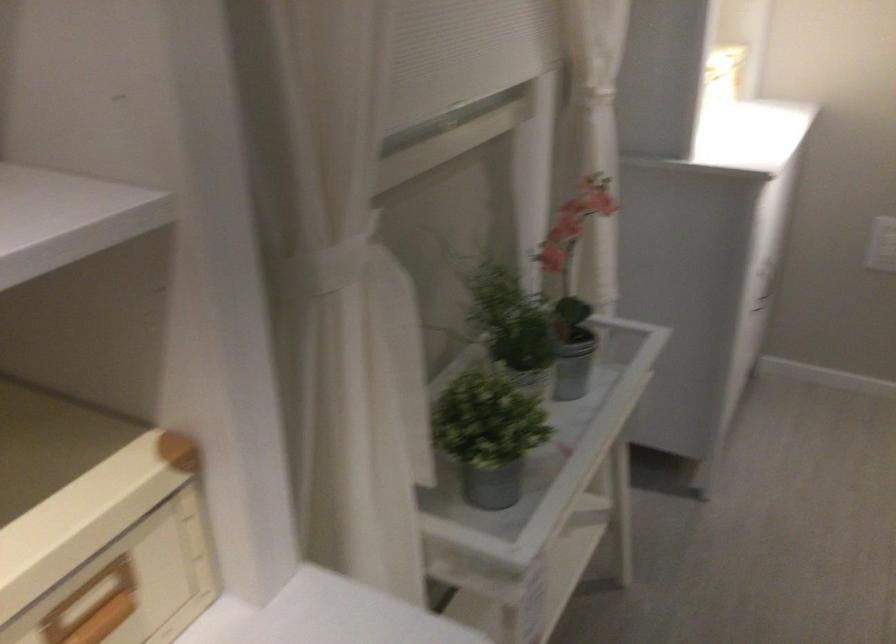
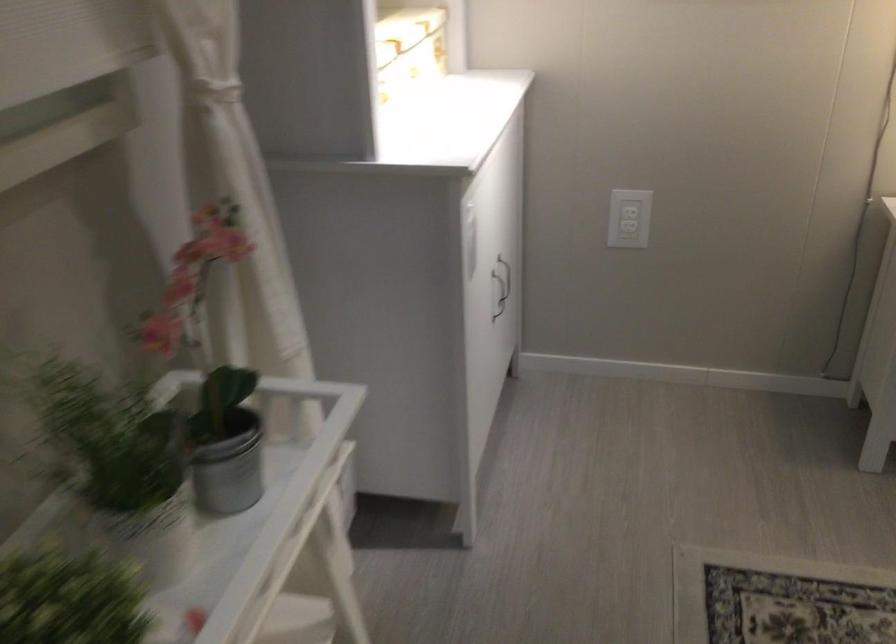
Question: The first image is from the beginning of the video and the second image is from the end. How did the camera likely rotate when shooting the video?

Choices:
 (A) Left
 (B) Right
 (C) Up
 (D) Down

Answer: (B)